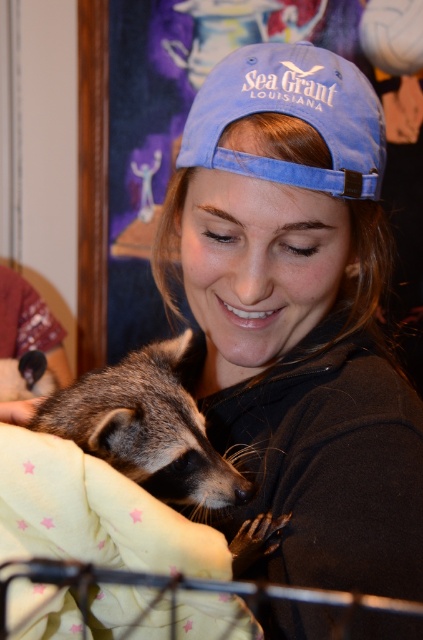
Question: Considering the real-world distances, which object is closest to the yellow fleece blanket at lower left?

Choices:
 (A) blue fabric baseball cap at upper center
 (B) fuzzy brown raccoon at lower left

Answer: (B)

Question: Which of the following is the closest to the observer?

Choices:
 (A) fuzzy brown raccoon at lower left
 (B) yellow fleece blanket at lower left
 (C) blue fabric baseball cap at upper center

Answer: (B)

Question: Does blue fabric baseball cap at upper center have a lesser width compared to fuzzy brown raccoon at lower left?

Choices:
 (A) no
 (B) yes

Answer: (B)

Question: Among these objects, which one is nearest to the camera?

Choices:
 (A) blue fabric baseball cap at upper center
 (B) fuzzy brown raccoon at lower left
 (C) yellow fleece blanket at lower left

Answer: (C)

Question: Does blue fabric baseball cap at upper center appear on the right side of fuzzy brown raccoon at lower left?

Choices:
 (A) yes
 (B) no

Answer: (A)

Question: Is yellow fleece blanket at lower left further to the viewer compared to blue fabric baseball cap at upper center?

Choices:
 (A) no
 (B) yes

Answer: (A)